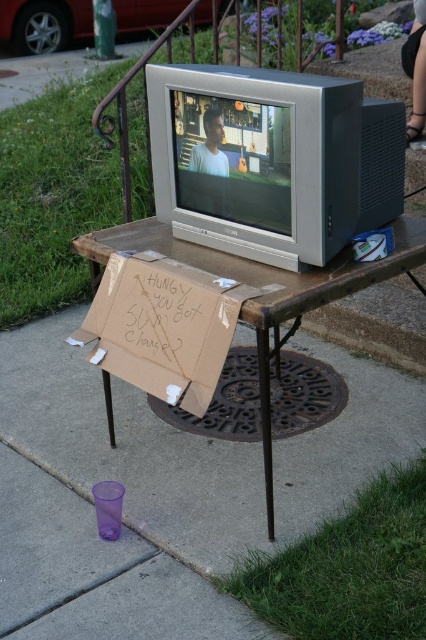
Question: Which point is farther to the camera?

Choices:
 (A) (85, 401)
 (B) (201, 316)

Answer: (A)

Question: Where is purple plastic cup at lower left located in relation to brown cardboard sign at center in the image?

Choices:
 (A) above
 (B) below

Answer: (B)

Question: From the image, what is the correct spatial relationship of purple plastic cup at lower left in relation to brown cardboard sign at center?

Choices:
 (A) above
 (B) below

Answer: (B)

Question: Which of the following is the farthest from the observer?

Choices:
 (A) (215, 291)
 (B) (241, 480)

Answer: (B)

Question: Where is purple plastic cup at lower left located in relation to brown cardboard sign at center in the image?

Choices:
 (A) above
 (B) below

Answer: (B)